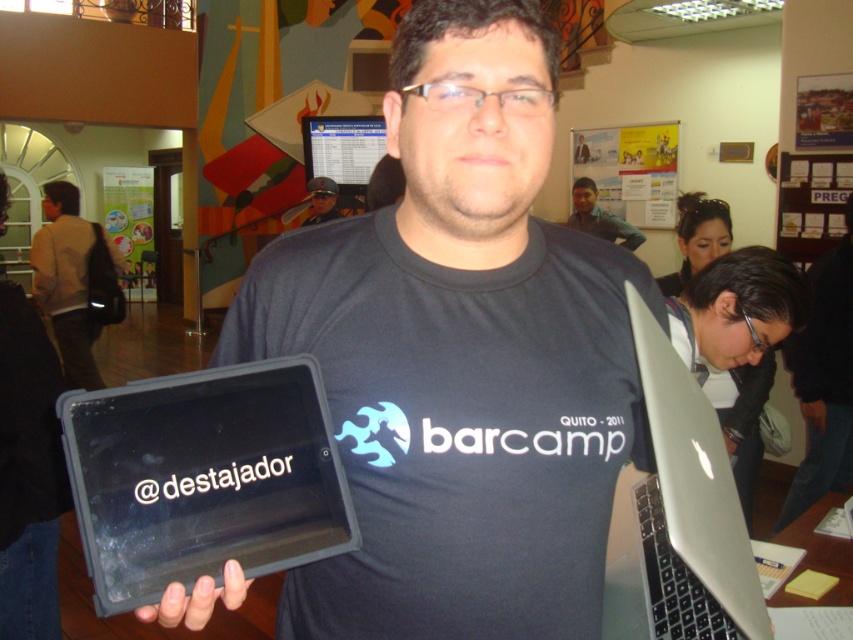
Is black matte tablet at left further to camera compared to black matte laptop at center?

No, black matte tablet at left is in front of black matte laptop at center.

The width and height of the screenshot is (853, 640). I want to click on black matte tablet at left, so click(28, 472).

Does point (33, 317) come behind point (833, 387)?

That is False.

You are a GUI agent. You are given a task and a screenshot of the screen. Output one action in this format:
    pyautogui.click(x=<x>, y=<y>)
    Task: Click on the black matte tablet at left
    
    Given the screenshot: What is the action you would take?
    pyautogui.click(x=28, y=472)

Between black plastic tablet at center and matte black tablet at center, which one has less height?

Standing shorter between the two is black plastic tablet at center.

Where is `black plastic tablet at center`? The width and height of the screenshot is (853, 640). black plastic tablet at center is located at coordinates (202, 477).

This screenshot has height=640, width=853. In order to click on black plastic tablet at center in this screenshot , I will do (202, 477).

In order to click on brown leather backpack at left in this screenshot , I will do `click(74, 282)`.

Can you confirm if brown leather backpack at left is positioned to the right of matte black laptop at upper center?

Incorrect, brown leather backpack at left is not on the right side of matte black laptop at upper center.

Find the location of `brown leather backpack at left`. brown leather backpack at left is located at coordinates (74, 282).